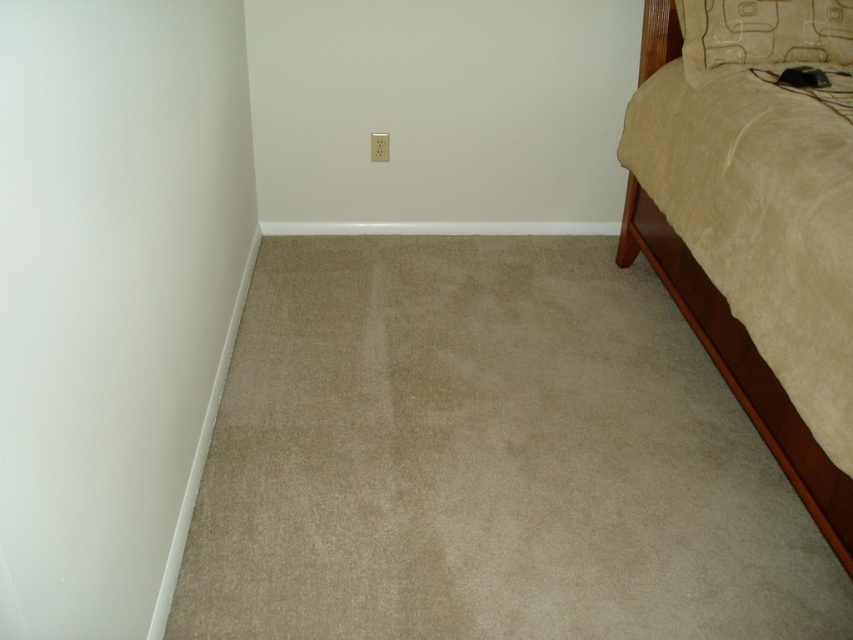
Question: Among these objects, which one is nearest to the camera?

Choices:
 (A) beige fabric pillow at upper right
 (B) beige suede bed at right

Answer: (B)

Question: From the image, what is the correct spatial relationship of beige suede bed at right in relation to beige fabric pillow at upper right?

Choices:
 (A) right
 (B) left

Answer: (B)

Question: Is beige suede bed at right positioned at the back of beige fabric pillow at upper right?

Choices:
 (A) no
 (B) yes

Answer: (A)

Question: Which point is closer to the camera taking this photo?

Choices:
 (A) (840, 484)
 (B) (775, 65)

Answer: (A)

Question: Which of the following is the closest to the observer?

Choices:
 (A) beige suede bed at right
 (B) beige fabric pillow at upper right

Answer: (A)

Question: Does beige suede bed at right have a lesser width compared to beige fabric pillow at upper right?

Choices:
 (A) no
 (B) yes

Answer: (B)